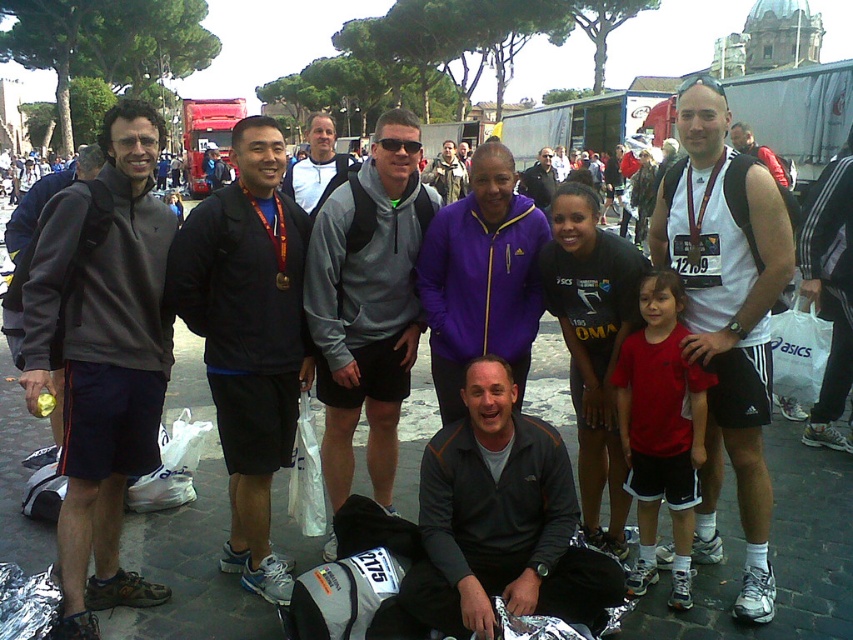
Question: Among these objects, which one is farthest from the camera?

Choices:
 (A) gray fleece jacket at center
 (B) matte gray hoodie at left

Answer: (A)

Question: Can you confirm if gray fleece hoodie at center is wider than matte black jacket at center?

Choices:
 (A) no
 (B) yes

Answer: (A)

Question: Estimate the real-world distances between objects in this image. Which object is farther from the dark gray sweatshirt at center?

Choices:
 (A) white matte tank top at center
 (B) purple fleece jacket at center
 (C) gray fleece jacket at center
 (D) gray fleece hoodie at center

Answer: (A)

Question: Is the position of gray fleece hoodie at center less distant than that of matte gray hoodie at left?

Choices:
 (A) yes
 (B) no

Answer: (B)

Question: Where is dark gray sweatshirt at center located in relation to gray fleece hoodie at center in the image?

Choices:
 (A) below
 (B) above

Answer: (A)

Question: Among these points, which one is nearest to the camera?

Choices:
 (A) (45, 280)
 (B) (553, 186)

Answer: (A)